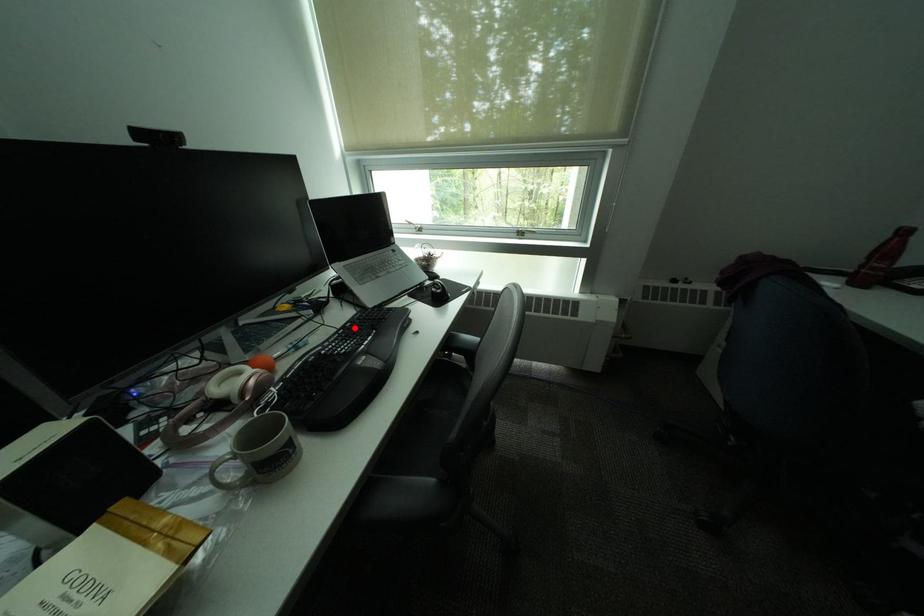
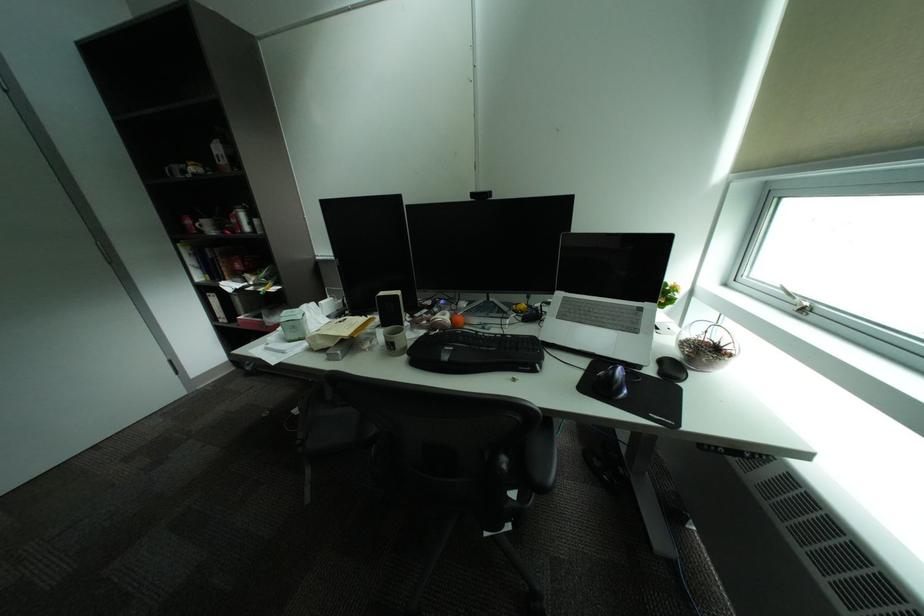
Where in the second image is the point corresponding to the highlighted location from the first image?

(516, 336)